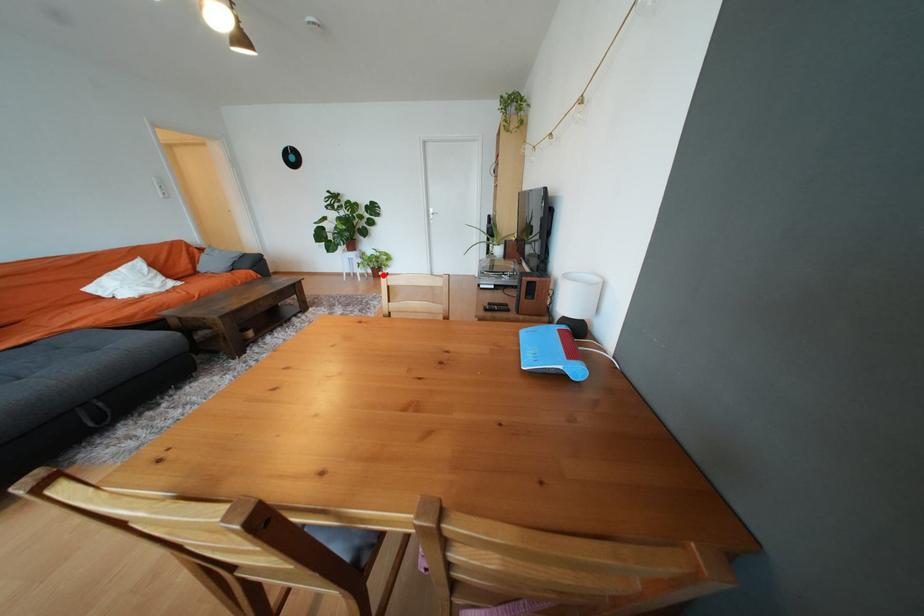
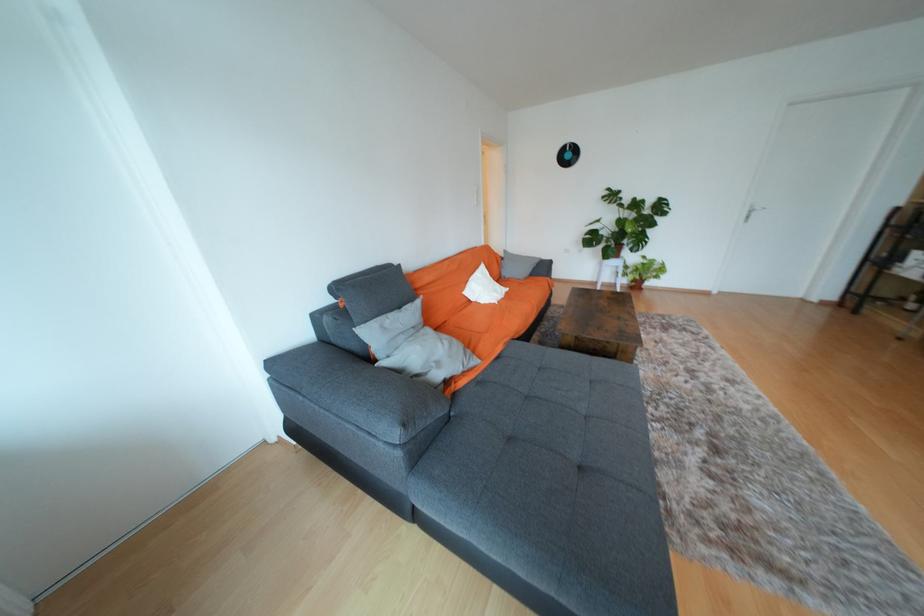
Question: I am providing you with two images of the same scene from different viewpoints. In image1, a red point is highlighted. Considering the same 3D point in image2, which of the following is correct?

Choices:
 (A) It is closer
 (B) It is farther

Answer: (A)